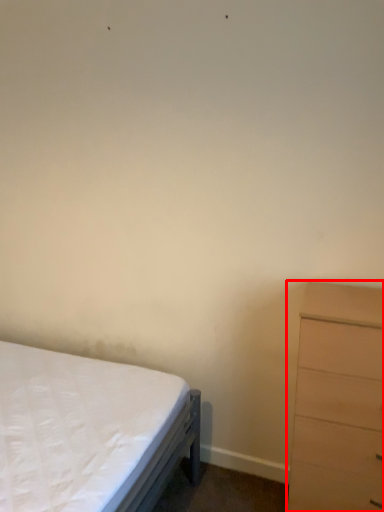
Question: From the image, what is the correct spatial relationship of chest of drawers (annotated by the red box) in relation to bed?

Choices:
 (A) left
 (B) right

Answer: (B)